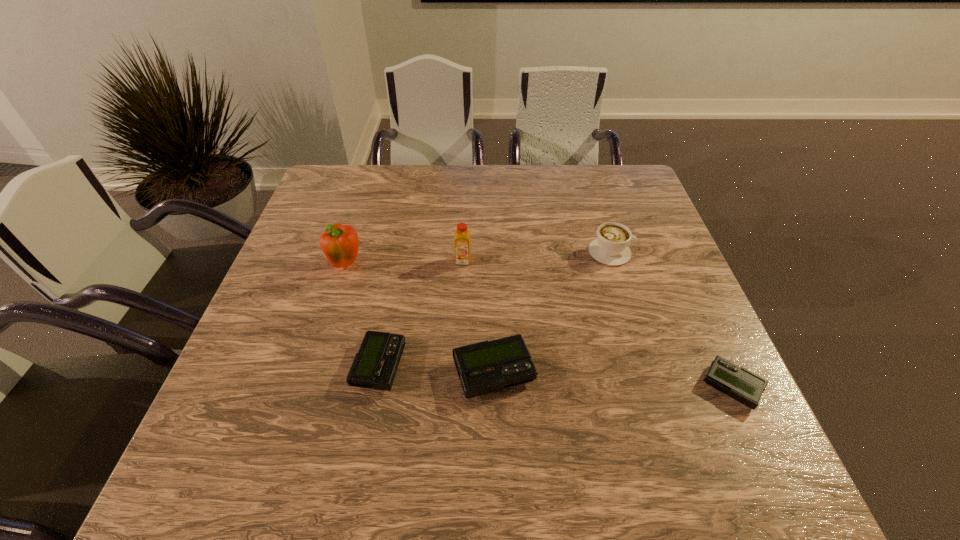
This screenshot has width=960, height=540. In order to click on empty location between the leftmost beeper and the second object from right to left in this screenshot , I will do `click(494, 309)`.

This screenshot has width=960, height=540. In order to click on unoccupied position between the leftmost object and the orange juice in this screenshot , I will do `click(405, 263)`.

Identify the location of free spot between the second beeper from left to right and the leftmost object. This screenshot has width=960, height=540. (420, 319).

Identify the location of free space between the fifth object from right to left and the fourth tallest object. The image size is (960, 540). (437, 369).

At what (x,y) coordinates should I click in order to perform the action: click on free space between the pepper and the fourth tallest object. Please return your answer as a coordinate pair (x, y). Looking at the image, I should click on (420, 319).

This screenshot has width=960, height=540. What are the coordinates of `blank region between the second beeper from right to left and the rightmost object` in the screenshot? It's located at (612, 380).

Point out which object is positioned as the third nearest to the shortest object. Please provide its 2D coordinates. Your answer should be formatted as a tuple, i.e. [(x, y)], where the tuple contains the x and y coordinates of a point satisfying the conditions above.

[(462, 236)]

Locate an element on the screen. This screenshot has width=960, height=540. object that stands as the fourth closest to the leftmost object is located at coordinates (611, 247).

At what (x,y) coordinates should I click in order to perform the action: click on beeper that is the closest one to the second tallest object. Please return your answer as a coordinate pair (x, y). The width and height of the screenshot is (960, 540). Looking at the image, I should click on (484, 367).

Where is `beeper that is the third closest to the fourth shortest object`? beeper that is the third closest to the fourth shortest object is located at coordinates (375, 365).